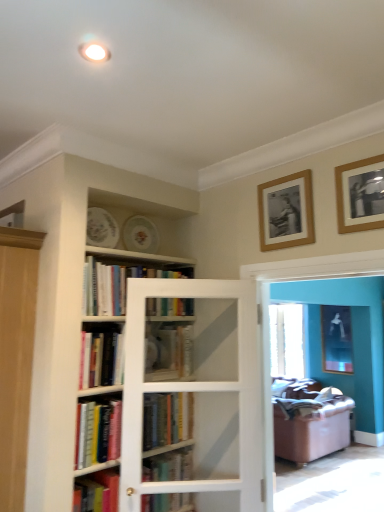
This screenshot has width=384, height=512. I want to click on free space above white glass cabinet at center, marked as the second screen door in a right-to-left arrangement (from a real-world perspective), so click(182, 281).